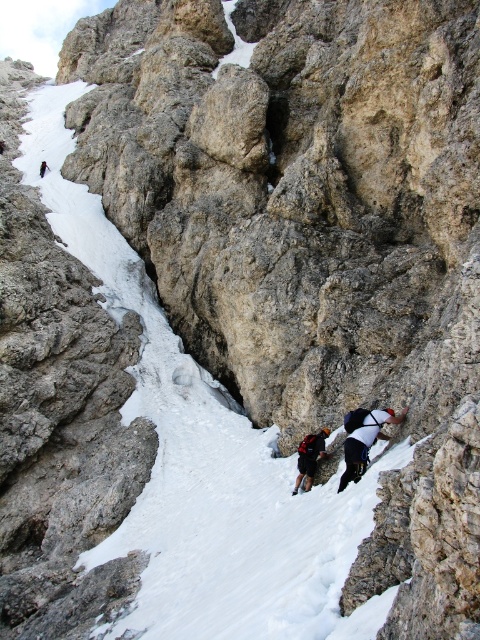
Does white fabric climbing harness at right appear on the left side of dark gray fabric backpack at center?

In fact, white fabric climbing harness at right is to the right of dark gray fabric backpack at center.

Which is behind, point (360, 429) or point (319, 433)?

Point (319, 433)

Which is in front, point (388, 413) or point (308, 465)?

Point (388, 413)

Find the location of a particular element. This screenshot has width=480, height=640. white fabric climbing harness at right is located at coordinates (363, 438).